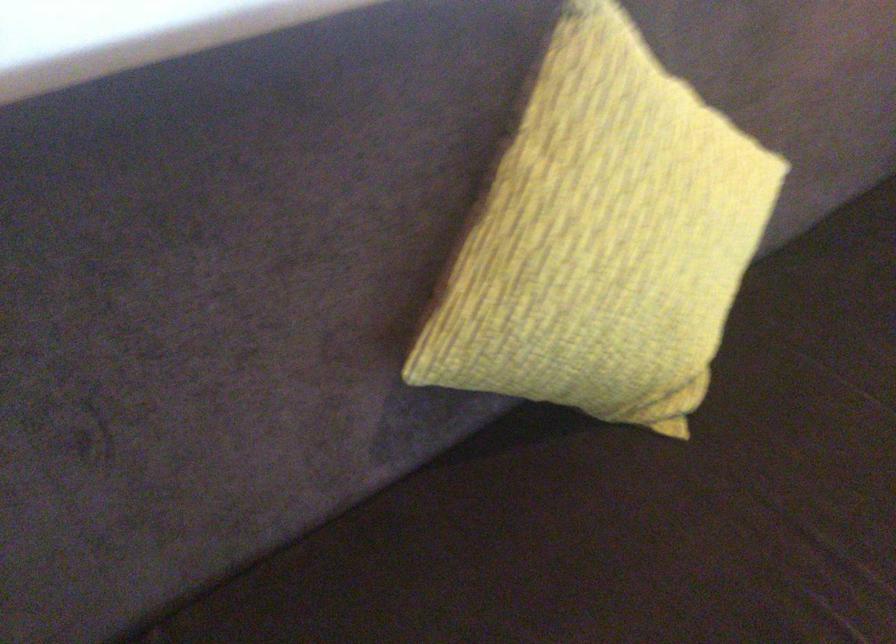
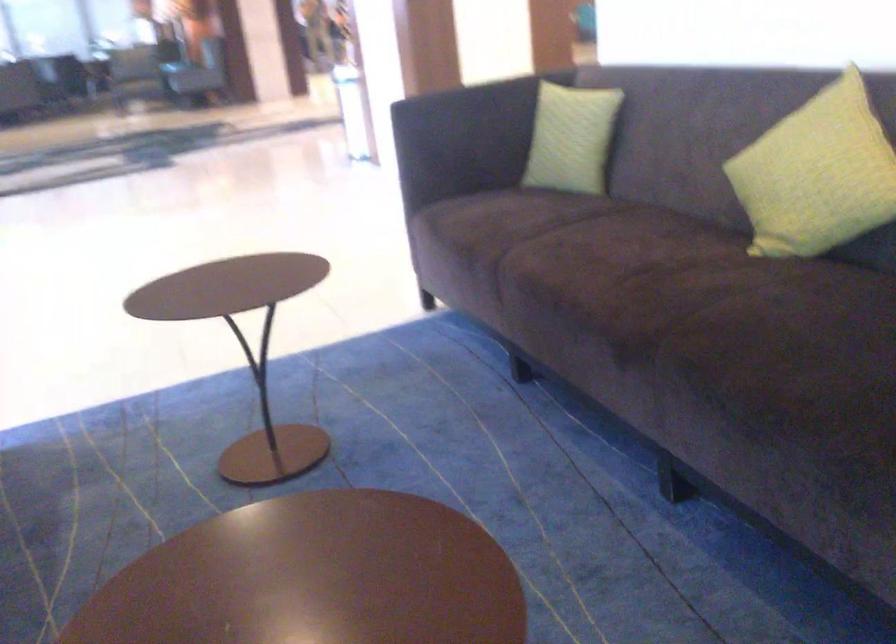
In the second image, find the point that corresponds to the point at 693,261 in the first image.

(816, 174)